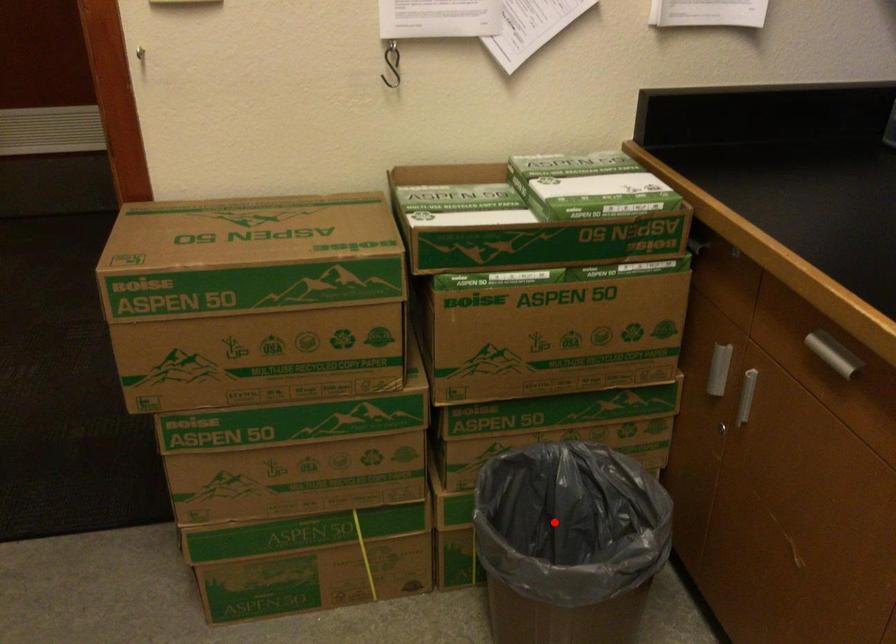
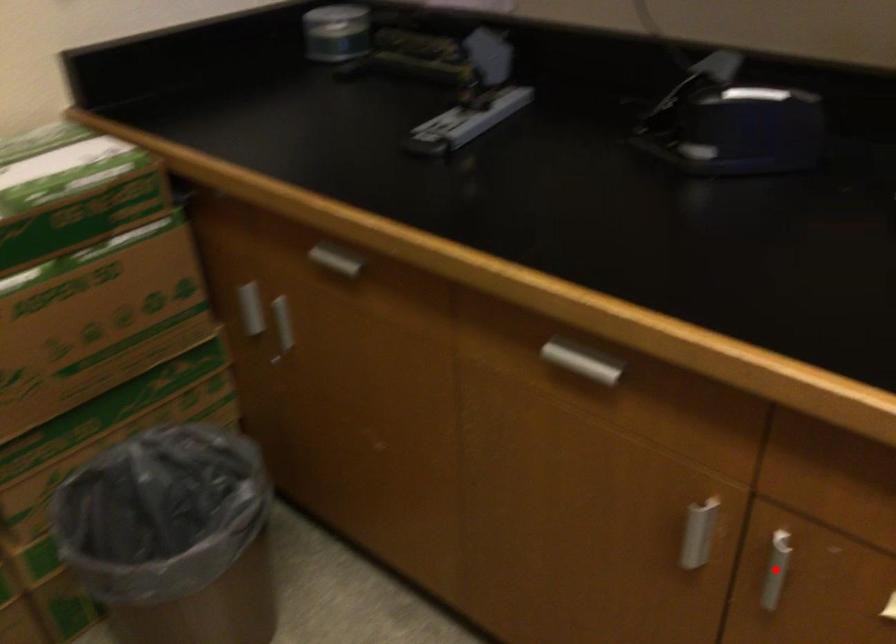
Based on the photo, I am providing you with two images of the same scene from different viewpoints. A red point is marked on the first image and another point is marked on the second image. Is the red point in image1 aligned with the point shown in image2?

No